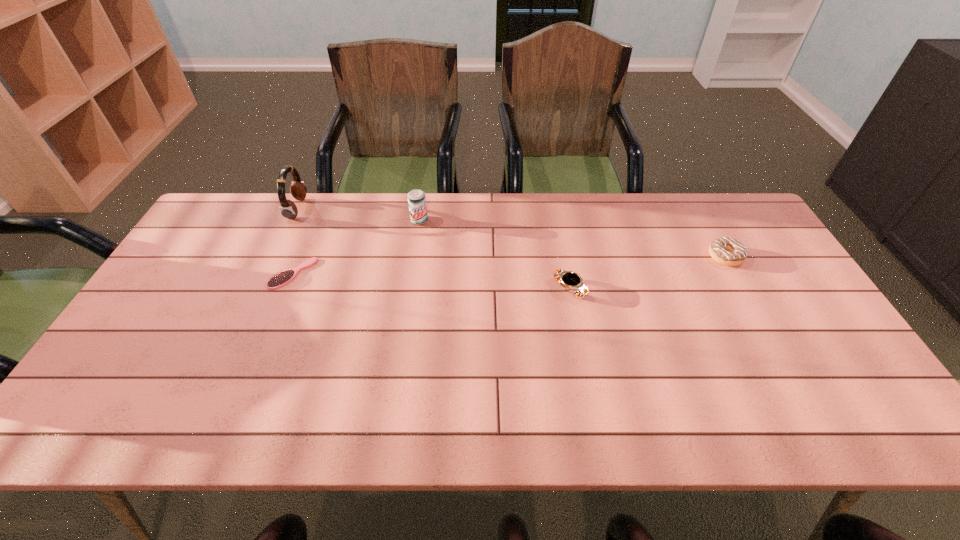
Image resolution: width=960 pixels, height=540 pixels. Identify the location of free region located on the back of the hairbrush. (310, 231).

Identify the location of headset situated at the far edge. (288, 209).

Identify the location of beer can at the far edge. (416, 198).

Identify the location of object present at the right edge. Image resolution: width=960 pixels, height=540 pixels. point(725,250).

You are a GUI agent. You are given a task and a screenshot of the screen. Output one action in this format:
    pyautogui.click(x=<x>, y=<y>)
    Task: Click on the vacant space at the far edge
    
    Given the screenshot: What is the action you would take?
    pyautogui.click(x=660, y=212)

In the image, there is a desktop. At what (x,y) coordinates should I click in order to perform the action: click on free space at the near edge. Please return your answer as a coordinate pair (x, y). The image size is (960, 540). Looking at the image, I should click on (267, 402).

Locate an element on the screen. The height and width of the screenshot is (540, 960). blank space at the left edge is located at coordinates (208, 253).

This screenshot has width=960, height=540. Identify the location of vacant space at the right edge. (756, 274).

The image size is (960, 540). Identify the location of free space between the third object from right to left and the doughnut. (572, 239).

Find the location of a particular element. This screenshot has width=960, height=540. free spot between the shortest object and the beer can is located at coordinates (356, 247).